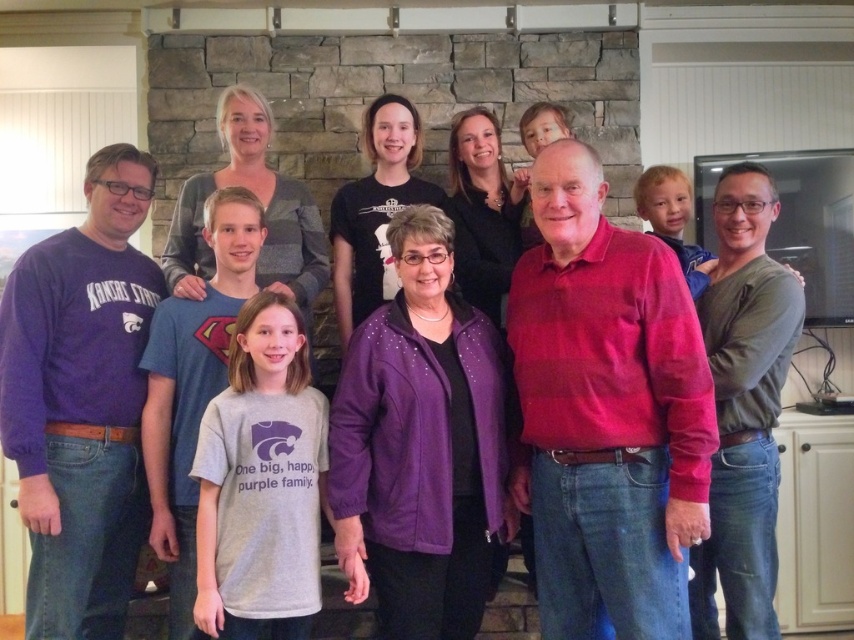
Question: Which point is closer to the camera?

Choices:
 (A) green matte shirt at upper right
 (B) purple fabric jacket at center
 (C) matte red sweater at center

Answer: (C)

Question: Which point is closer to the camera?

Choices:
 (A) green matte shirt at upper right
 (B) purple fabric jacket at center
 (C) matte red sweater at center

Answer: (C)

Question: Is purple fabric jacket at center to the right of green matte shirt at upper right from the viewer's perspective?

Choices:
 (A) yes
 (B) no

Answer: (B)

Question: Is matte red sweater at center in front of purple fabric jacket at center?

Choices:
 (A) no
 (B) yes

Answer: (B)

Question: Which point is closer to the camera?

Choices:
 (A) (477, 417)
 (B) (793, 307)
 (C) (604, 444)

Answer: (C)

Question: Can you confirm if purple fabric jacket at center is positioned to the left of green matte shirt at upper right?

Choices:
 (A) no
 (B) yes

Answer: (B)